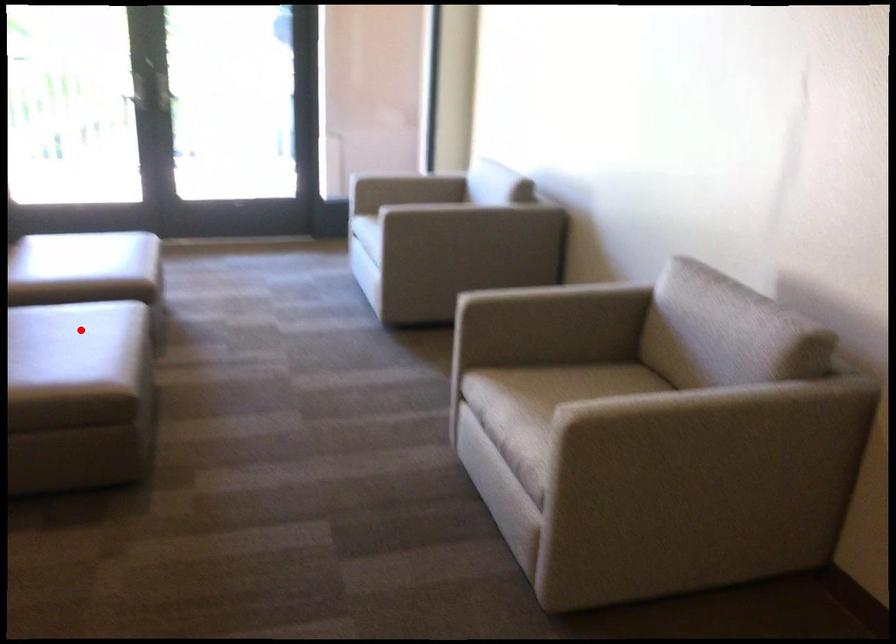
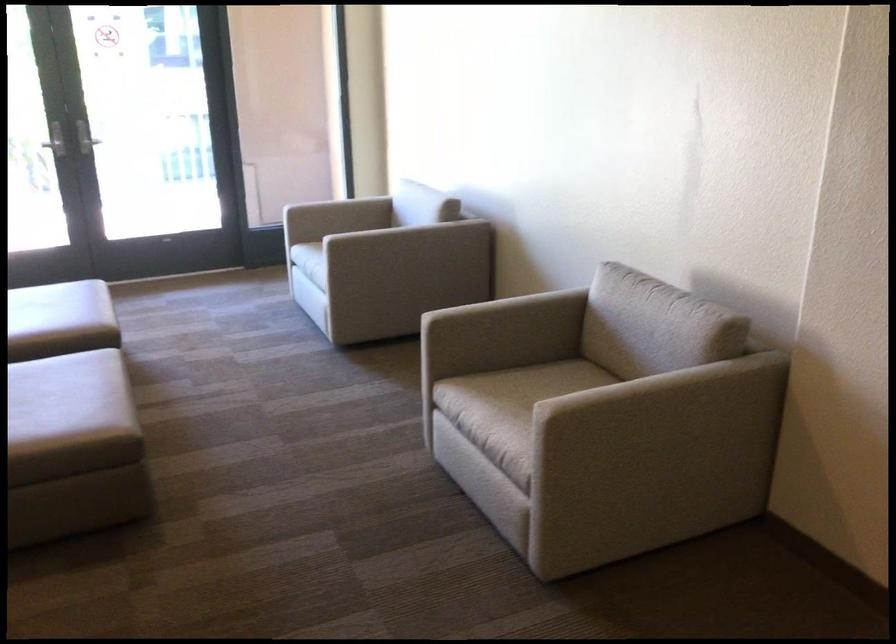
The point at the highlighted location is marked in the first image. Where is the corresponding point in the second image?

(65, 384)